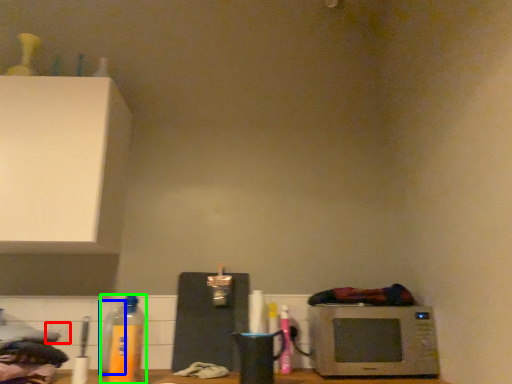
Question: Estimate the real-world distances between objects in this image. Which object is farther from electric outlet (highlighted by a red box), bottle (highlighted by a blue box) or bottle (highlighted by a green box)?

Choices:
 (A) bottle
 (B) bottle

Answer: (B)